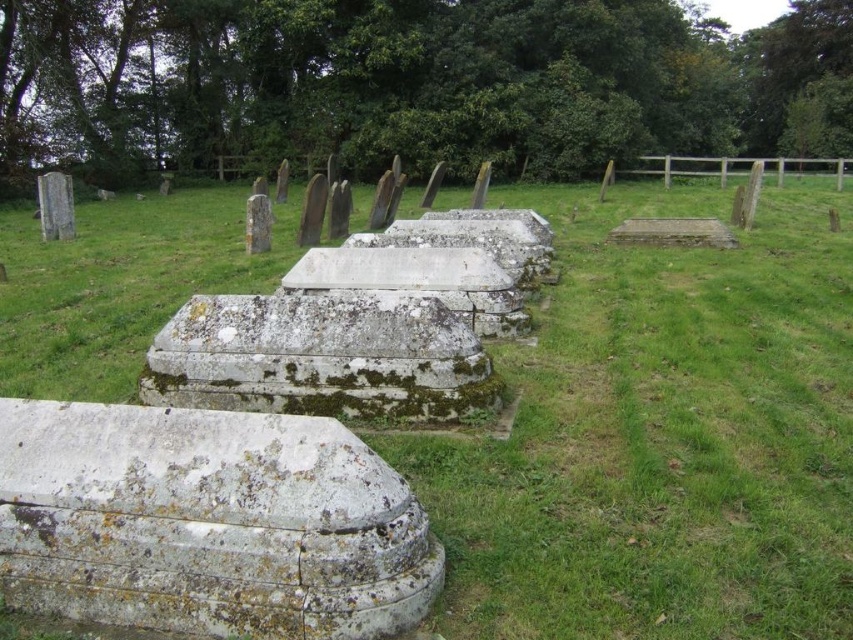
Does green mossy stone at center have a lesser height compared to mossy stone sarcophagus at center?

No, green mossy stone at center is not shorter than mossy stone sarcophagus at center.

Is green mossy stone at center bigger than mossy stone sarcophagus at center?

Yes, green mossy stone at center is bigger than mossy stone sarcophagus at center.

This screenshot has height=640, width=853. What do you see at coordinates (660, 433) in the screenshot? I see `green mossy stone at center` at bounding box center [660, 433].

This screenshot has height=640, width=853. Find the location of `green mossy stone at center`. green mossy stone at center is located at coordinates (660, 433).

Can you confirm if mossy concrete sarcophagus at lower left is thinner than mossy stone sarcophagus at center?

Correct, mossy concrete sarcophagus at lower left's width is less than mossy stone sarcophagus at center's.

Does mossy concrete sarcophagus at lower left have a smaller size compared to mossy stone sarcophagus at center?

Indeed, mossy concrete sarcophagus at lower left has a smaller size compared to mossy stone sarcophagus at center.

Which is behind, point (431, 592) or point (286, 401)?

Point (286, 401)

Where is `mossy concrete sarcophagus at lower left`? This screenshot has width=853, height=640. mossy concrete sarcophagus at lower left is located at coordinates (207, 524).

Is green mossy stone at center to the left of mossy concrete sarcophagus at lower left from the viewer's perspective?

Correct, you'll find green mossy stone at center to the left of mossy concrete sarcophagus at lower left.

The image size is (853, 640). I want to click on green mossy stone at center, so click(660, 433).

Describe the element at coordinates (660, 433) in the screenshot. I see `green mossy stone at center` at that location.

Find the location of a particular element. The image size is (853, 640). green mossy stone at center is located at coordinates (660, 433).